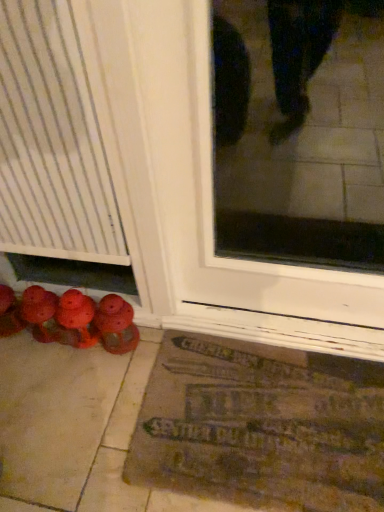
The width and height of the screenshot is (384, 512). Identify the location of free space between matte red shoes at lower left, positioned as the 2th footwear in left-to-right order, and brown textured mat at lower center. (136, 385).